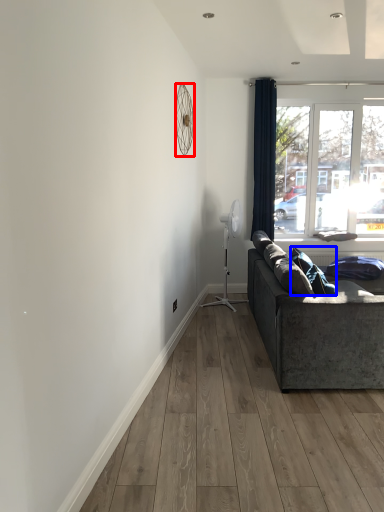
Question: Which object appears closest to the camera in this image, mechanical fan (highlighted by a red box) or pillow (highlighted by a blue box)?

Choices:
 (A) mechanical fan
 (B) pillow

Answer: (A)